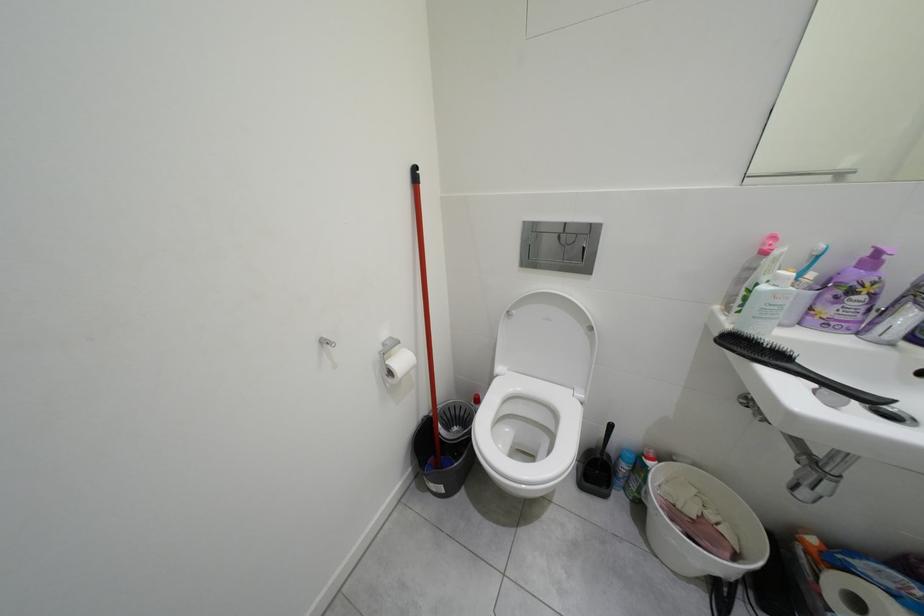
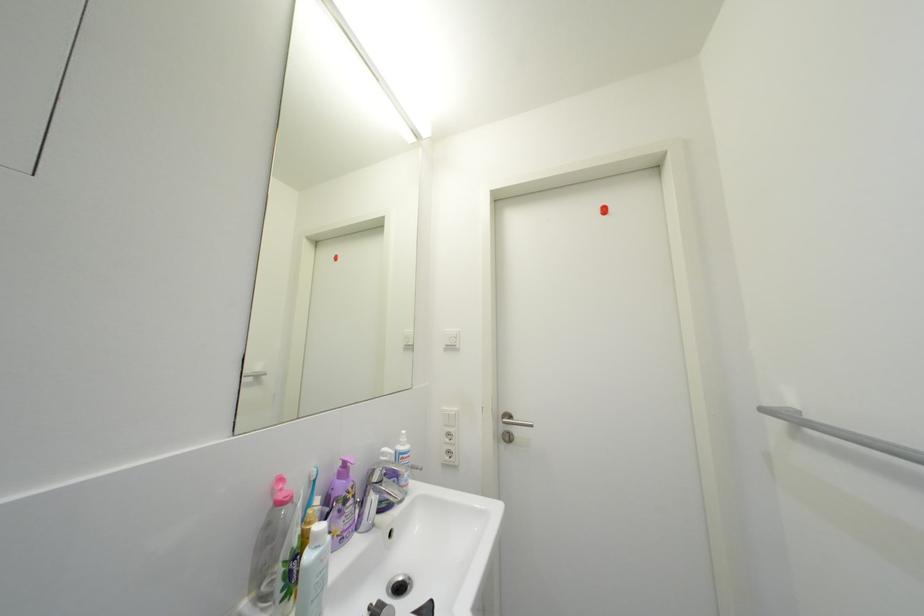
Question: The camera is either moving clockwise (left) or counter-clockwise (right) around the object. The first image is from the beginning of the video and the second image is from the end. Is the camera moving left or right when shooting the video?

Choices:
 (A) Left
 (B) Right

Answer: (A)